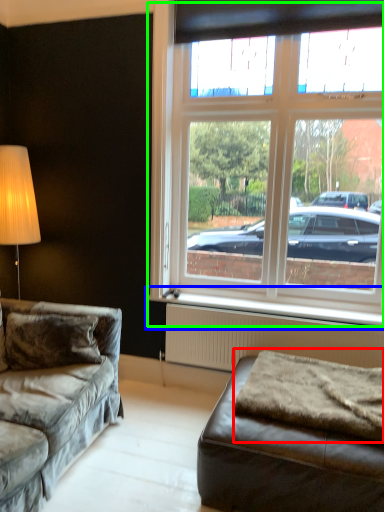
Question: Which is farther away from blanket (highlighted by a red box)? window sill (highlighted by a blue box) or window (highlighted by a green box)?

Choices:
 (A) window sill
 (B) window

Answer: (B)